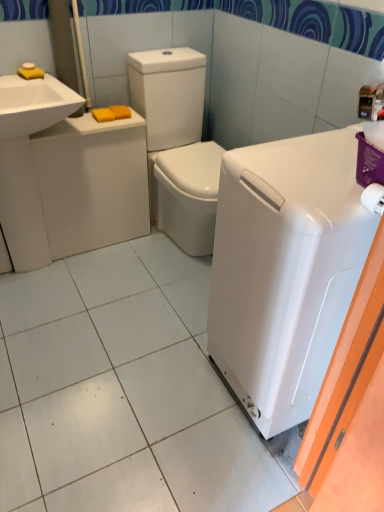
Question: Can you confirm if white glossy washer at center is thinner than white glossy washing machine at right?

Choices:
 (A) no
 (B) yes

Answer: (A)

Question: From a real-world perspective, does white glossy washer at center sit lower than white glossy washing machine at right?

Choices:
 (A) yes
 (B) no

Answer: (A)

Question: From the image's perspective, is white glossy washer at center located beneath white glossy washing machine at right?

Choices:
 (A) yes
 (B) no

Answer: (B)

Question: Does white glossy washer at center touch white glossy washing machine at right?

Choices:
 (A) no
 (B) yes

Answer: (A)

Question: Is white glossy washer at center shorter than white glossy washing machine at right?

Choices:
 (A) no
 (B) yes

Answer: (B)

Question: Is white glossy washer at center oriented away from white glossy washing machine at right?

Choices:
 (A) yes
 (B) no

Answer: (B)

Question: From a real-world perspective, is white glossy washing machine at right below white glossy sink at upper left, the 2th sink positioned from the bottom?

Choices:
 (A) no
 (B) yes

Answer: (B)

Question: Is white glossy sink at upper left, marked as the first sink in a top-to-bottom arrangement, located within white glossy washing machine at right?

Choices:
 (A) no
 (B) yes

Answer: (A)

Question: Is white glossy washing machine at right with white glossy sink at upper left, marked as the first sink in a top-to-bottom arrangement?

Choices:
 (A) yes
 (B) no

Answer: (B)

Question: Is white glossy washing machine at right not within white glossy sink at upper left, the 2th sink positioned from the bottom?

Choices:
 (A) no
 (B) yes

Answer: (B)

Question: Is white glossy washing machine at right thinner than white glossy sink at upper left, the 2th sink positioned from the bottom?

Choices:
 (A) yes
 (B) no

Answer: (B)

Question: Is white glossy washing machine at right wider than white glossy sink at upper left, the 2th sink positioned from the bottom?

Choices:
 (A) no
 (B) yes

Answer: (B)

Question: Can you confirm if white glossy washing machine at right is shorter than white glossy washer at center?

Choices:
 (A) no
 (B) yes

Answer: (A)